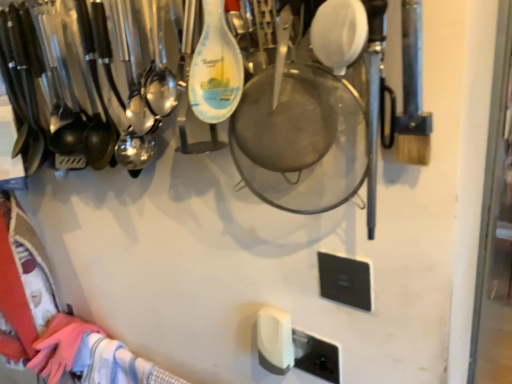
How much space does black plastic light switch at lower right, the second light switch viewed from the left, occupy vertically?

3.46 inches.

Describe the element at coordinates (345, 280) in the screenshot. The image size is (512, 384). I see `black plastic light switch at lower right, the first light switch when ordered from top to bottom` at that location.

The image size is (512, 384). What are the coordinates of `black plastic light switch at lower right, the 2th light switch in the back-to-front sequence` in the screenshot? It's located at (345, 280).

What is the approximate width of white plastic light switch at lower center, the first light switch in the left-to-right sequence?

It is 1.07 inches.

This screenshot has height=384, width=512. I want to click on white plastic light switch at lower center, positioned as the 2th light switch in right-to-left order, so click(x=275, y=340).

Image resolution: width=512 pixels, height=384 pixels. Describe the element at coordinates (275, 340) in the screenshot. I see `white plastic light switch at lower center, positioned as the 2th light switch in right-to-left order` at that location.

The width and height of the screenshot is (512, 384). Find the location of `black plastic light switch at lower right, the 1th light switch when ordered from right to left`. black plastic light switch at lower right, the 1th light switch when ordered from right to left is located at coordinates (345, 280).

Does black plastic light switch at lower right, the 1th light switch when ordered from right to left, appear on the left side of white plastic light switch at lower center, the first light switch in the left-to-right sequence?

No.

Is black plastic light switch at lower right, the second light switch viewed from the left, behind white plastic light switch at lower center, the first light switch ordered from the bottom?

No, it is not.

Is point (362, 273) closer or farther from the camera than point (273, 334)?

Point (362, 273) appears to be closer to the viewer than point (273, 334).

Based on the photo, from the image's perspective, who appears lower, black plastic light switch at lower right, the second light switch viewed from the left, or white plastic light switch at lower center, positioned as the 2th light switch in right-to-left order?

From the image's view, white plastic light switch at lower center, positioned as the 2th light switch in right-to-left order, is below.

From a real-world perspective, does black plastic light switch at lower right, the 1th light switch when ordered from right to left, stand above white plastic light switch at lower center, the 1th light switch in the back-to-front sequence?

Yes, from a real-world perspective, black plastic light switch at lower right, the 1th light switch when ordered from right to left, is over white plastic light switch at lower center, the 1th light switch in the back-to-front sequence

Considering the sizes of black plastic light switch at lower right, the second light switch viewed from the left, and white plastic light switch at lower center, which appears as the second light switch when viewed from the top, in the image, is black plastic light switch at lower right, the second light switch viewed from the left, wider or thinner than white plastic light switch at lower center, which appears as the second light switch when viewed from the top,?

black plastic light switch at lower right, the second light switch viewed from the left, is thinner than white plastic light switch at lower center, which appears as the second light switch when viewed from the top.

Is black plastic light switch at lower right, which appears as the 1th light switch when viewed from the front, taller than white plastic light switch at lower center, the first light switch in the left-to-right sequence?

No.

Does black plastic light switch at lower right, the 2th light switch in the back-to-front sequence, have a smaller size compared to white plastic light switch at lower center, the 1th light switch in the back-to-front sequence?

Yes.

Is white plastic light switch at lower center, the first light switch in the left-to-right sequence, completely or partially inside black plastic light switch at lower right, the second light switch viewed from the left?

No, white plastic light switch at lower center, the first light switch in the left-to-right sequence, is located outside of black plastic light switch at lower right, the second light switch viewed from the left.

From the picture: Is black plastic light switch at lower right, which appears as the 1th light switch when viewed from the front, not near white plastic light switch at lower center, the first light switch in the left-to-right sequence?

No, black plastic light switch at lower right, which appears as the 1th light switch when viewed from the front, is not far from white plastic light switch at lower center, the first light switch in the left-to-right sequence.

Is white plastic light switch at lower center, positioned as the 2th light switch in right-to-left order, at the back of black plastic light switch at lower right, which appears as the 1th light switch when viewed from the front?

black plastic light switch at lower right, which appears as the 1th light switch when viewed from the front, is not turned away from white plastic light switch at lower center, positioned as the 2th light switch in right-to-left order.

Where is `light switch below the black plastic light switch at lower right, the 2th light switch in the back-to-front sequence (from a real-world perspective)`? This screenshot has height=384, width=512. light switch below the black plastic light switch at lower right, the 2th light switch in the back-to-front sequence (from a real-world perspective) is located at coordinates (275, 340).

Is white plastic light switch at lower center, the 1th light switch in the back-to-front sequence, to the right of black plastic light switch at lower right, the 1th light switch when ordered from right to left, from the viewer's perspective?

Incorrect, white plastic light switch at lower center, the 1th light switch in the back-to-front sequence, is not on the right side of black plastic light switch at lower right, the 1th light switch when ordered from right to left.

Relative to black plastic light switch at lower right, the first light switch when ordered from top to bottom, is white plastic light switch at lower center, which appears as the second light switch when viewed from the top, in front or behind?

Clearly, white plastic light switch at lower center, which appears as the second light switch when viewed from the top, is behind black plastic light switch at lower right, the first light switch when ordered from top to bottom.

Is point (289, 329) positioned in front of point (341, 295)?

No, (289, 329) is further to viewer.

From the image's perspective, is white plastic light switch at lower center, the 1th light switch in the back-to-front sequence, located above black plastic light switch at lower right, the 1th light switch when ordered from right to left?

No.

From a real-world perspective, between white plastic light switch at lower center, the first light switch ordered from the bottom, and black plastic light switch at lower right, the 1th light switch when ordered from right to left, who is vertically higher?

From a 3D spatial view, black plastic light switch at lower right, the 1th light switch when ordered from right to left, is above.

Does white plastic light switch at lower center, positioned as the second light switch in front-to-back order, have a lesser width compared to black plastic light switch at lower right, the 2th light switch in the back-to-front sequence?

No.

Who is shorter, white plastic light switch at lower center, the first light switch in the left-to-right sequence, or black plastic light switch at lower right, the first light switch when ordered from top to bottom?

With less height is black plastic light switch at lower right, the first light switch when ordered from top to bottom.

Between white plastic light switch at lower center, which appears as the second light switch when viewed from the top, and black plastic light switch at lower right, the 2th light switch ordered from the bottom, which one has smaller size?

black plastic light switch at lower right, the 2th light switch ordered from the bottom.

Is white plastic light switch at lower center, positioned as the second light switch in front-to-back order, inside the boundaries of black plastic light switch at lower right, the 2th light switch in the back-to-front sequence, or outside?

white plastic light switch at lower center, positioned as the second light switch in front-to-back order, is spatially situated outside black plastic light switch at lower right, the 2th light switch in the back-to-front sequence.

Is there a large distance between white plastic light switch at lower center, the first light switch in the left-to-right sequence, and black plastic light switch at lower right, which appears as the 1th light switch when viewed from the front?

No, white plastic light switch at lower center, the first light switch in the left-to-right sequence, is not far away from black plastic light switch at lower right, which appears as the 1th light switch when viewed from the front.

Is white plastic light switch at lower center, the 1th light switch in the back-to-front sequence, positioned with its back to black plastic light switch at lower right, the 1th light switch when ordered from right to left?

No, black plastic light switch at lower right, the 1th light switch when ordered from right to left, is not at the back of white plastic light switch at lower center, the 1th light switch in the back-to-front sequence.

How many degrees apart are the facing directions of white plastic light switch at lower center, the first light switch ordered from the bottom, and black plastic light switch at lower right, the first light switch when ordered from top to bottom?

They differ by 0.0113 degrees in their facing directions.

Identify the location of light switch located on the left of black plastic light switch at lower right, the second light switch viewed from the left. (275, 340).

This screenshot has height=384, width=512. There is a white plastic light switch at lower center, positioned as the 2th light switch in right-to-left order. What are the coordinates of `light switch above it (from a real-world perspective)` in the screenshot? It's located at click(x=345, y=280).

The width and height of the screenshot is (512, 384). In order to click on light switch that is behind the black plastic light switch at lower right, the 2th light switch ordered from the bottom in this screenshot , I will do `click(275, 340)`.